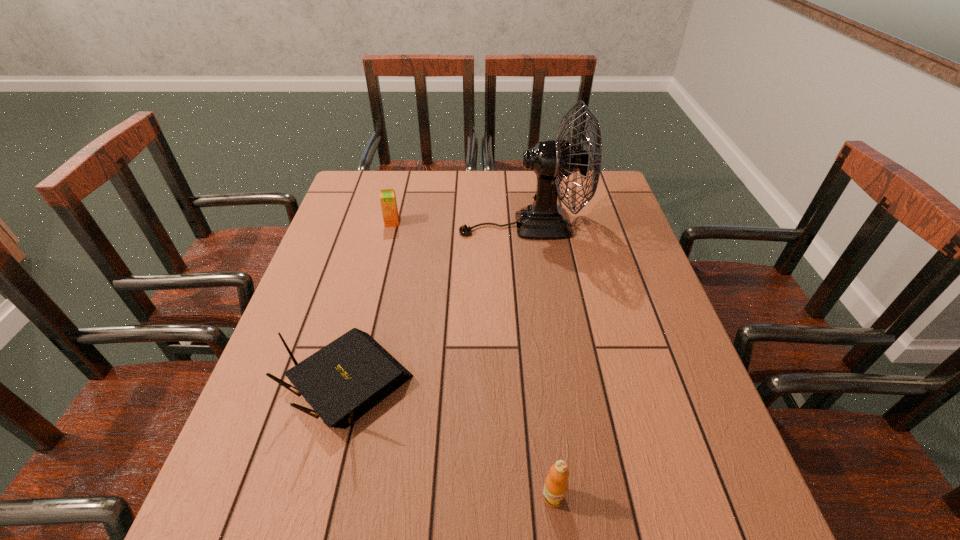
The image size is (960, 540). What are the coordinates of `free area in between the router and the farther orange juice` in the screenshot? It's located at (371, 301).

Locate an element on the screen. This screenshot has width=960, height=540. vacant space in between the router and the fan is located at coordinates (436, 303).

This screenshot has height=540, width=960. I want to click on free spot between the right orange juice and the router, so click(x=451, y=438).

Find the location of a particular element. The height and width of the screenshot is (540, 960). blank region between the nearer orange juice and the router is located at coordinates (451, 438).

The image size is (960, 540). In order to click on empty space between the right orange juice and the left orange juice in this screenshot , I will do `click(472, 360)`.

Where is `free space between the second nearest object and the farther orange juice`? free space between the second nearest object and the farther orange juice is located at coordinates (371, 301).

You are a GUI agent. You are given a task and a screenshot of the screen. Output one action in this format:
    pyautogui.click(x=<x>, y=<y>)
    Task: Click on the empty space between the right orange juice and the third farthest object
    
    Given the screenshot: What is the action you would take?
    pyautogui.click(x=451, y=438)

Locate an element on the screen. free spot between the tallest object and the nearest object is located at coordinates (539, 361).

Find the location of a particular element. vacant space that is in between the farther orange juice and the fan is located at coordinates (458, 224).

Choose which object is the third nearest neighbor to the third farthest object. Please provide its 2D coordinates. Your answer should be formatted as a tuple, i.e. [(x, y)], where the tuple contains the x and y coordinates of a point satisfying the conditions above.

[(388, 202)]